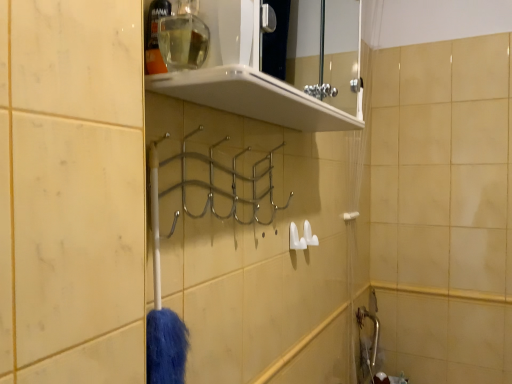
Question: Is white glossy shelf at upper center positioned behind clear plastic bottle at upper center, the 2th toiletry in the right-to-left sequence?

Choices:
 (A) yes
 (B) no

Answer: (B)

Question: Does white glossy shelf at upper center come in front of clear plastic bottle at upper center, the 2th toiletry in the right-to-left sequence?

Choices:
 (A) yes
 (B) no

Answer: (A)

Question: From the image's perspective, is white glossy shelf at upper center located above clear plastic bottle at upper center, the first toiletry viewed from the left?

Choices:
 (A) no
 (B) yes

Answer: (B)

Question: Considering the relative sizes of white glossy shelf at upper center and clear plastic bottle at upper center, the 2th toiletry in the right-to-left sequence, in the image provided, is white glossy shelf at upper center thinner than clear plastic bottle at upper center, the 2th toiletry in the right-to-left sequence,?

Choices:
 (A) no
 (B) yes

Answer: (A)

Question: From the image's perspective, is white glossy shelf at upper center beneath clear plastic bottle at upper center, the 2th toiletry in the right-to-left sequence?

Choices:
 (A) yes
 (B) no

Answer: (B)

Question: From a real-world perspective, does white glossy shelf at upper center sit lower than clear plastic bottle at upper center, the 2th toiletry in the right-to-left sequence?

Choices:
 (A) no
 (B) yes

Answer: (A)

Question: Is clear glass bottle at upper center, marked as the second toiletry in a left-to-right arrangement, behind translucent plastic shower curtain at right?

Choices:
 (A) no
 (B) yes

Answer: (A)

Question: From the image's perspective, is clear glass bottle at upper center, the first toiletry from the right, above translucent plastic shower curtain at right?

Choices:
 (A) no
 (B) yes

Answer: (B)

Question: Is clear glass bottle at upper center, the first toiletry from the right, not inside translucent plastic shower curtain at right?

Choices:
 (A) yes
 (B) no

Answer: (A)

Question: Is clear glass bottle at upper center, marked as the second toiletry in a left-to-right arrangement, facing away from translucent plastic shower curtain at right?

Choices:
 (A) no
 (B) yes

Answer: (A)

Question: Does clear glass bottle at upper center, the first toiletry from the right, have a lesser height compared to translucent plastic shower curtain at right?

Choices:
 (A) yes
 (B) no

Answer: (A)

Question: From a real-world perspective, is clear glass bottle at upper center, marked as the second toiletry in a left-to-right arrangement, on translucent plastic shower curtain at right?

Choices:
 (A) yes
 (B) no

Answer: (A)

Question: Is clear plastic bottle at upper center, the first toiletry viewed from the left, positioned beyond the bounds of white plastic towel bar at right?

Choices:
 (A) yes
 (B) no

Answer: (A)